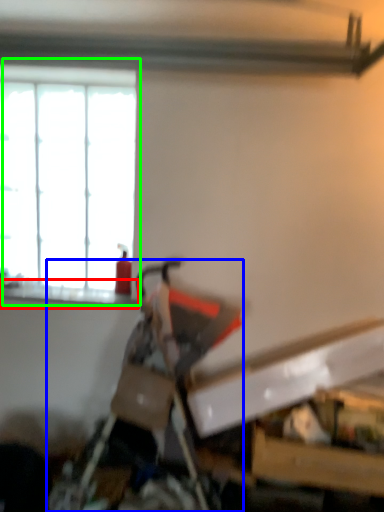
Question: Which is farther away from window sill (highlighted by a red box)? swivel chair (highlighted by a blue box) or window (highlighted by a green box)?

Choices:
 (A) swivel chair
 (B) window

Answer: (A)